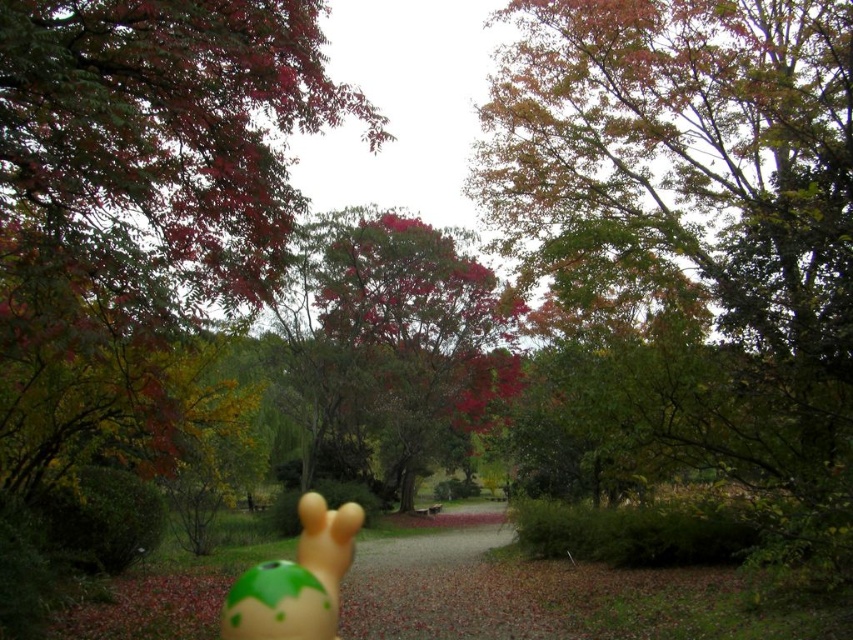
You are a park visitor who wants to take a photo of both the green leafy tree at upper center and the matte green rubber toy at center. Since you can only focus on one object at a time, which object should you focus on to ensure it appears larger in your photo?

You should focus on the green leafy tree at upper center because it has a larger size compared to the matte green rubber toy at center, so it will appear bigger in the photo.

You are a photographer standing in the park and want to take a photo of the green leafy tree at upper center and the matte green rubber toy at center. Which object should you focus on first if you want both to be in sharp focus?

You should focus on the green leafy tree at upper center first because it is closer to you than the matte green rubber toy at center. By focusing on the closer object, the farther object will also be in focus due to the depth of field.

You are a child playing in the park and want to place the smooth red leaves at upper left and the matte green rubber toy at center on a shelf. If the shelf has limited space, which object should you place first to ensure both fit?

The smooth red leaves at upper left has a lesser width compared to the matte green rubber toy at center, so you should place the matte green rubber toy at center first to ensure both fit on the shelf.